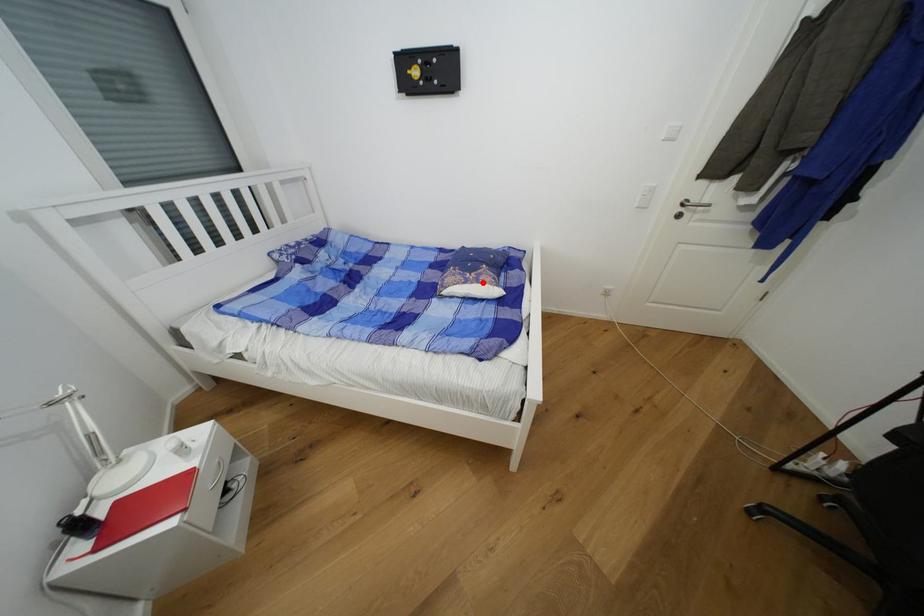
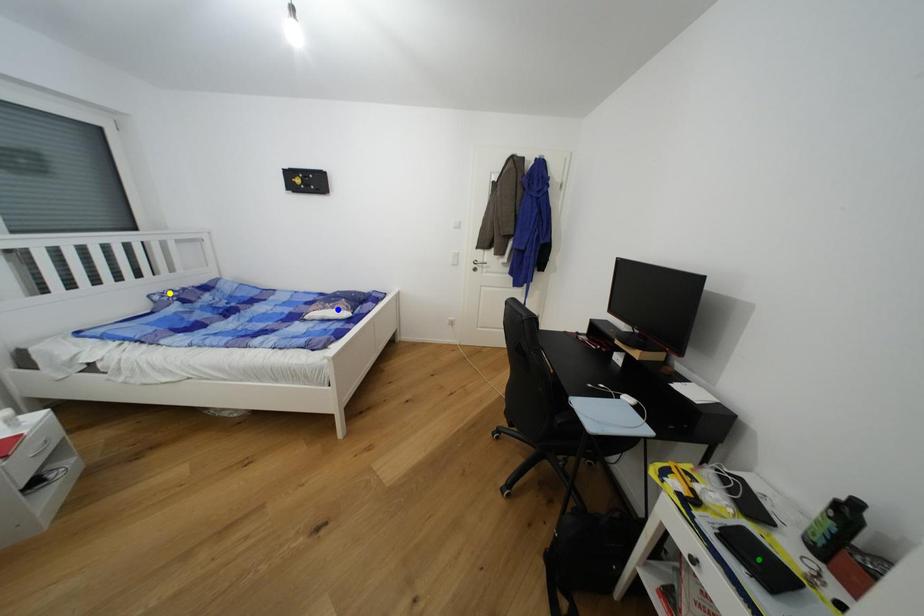
Question: I am providing you with two images of the same scene from different viewpoints. A red point is marked on the first image. You are given multiple points on the second image. Which point in image 2 is actually the same real-world point as the red point in image 1?

Choices:
 (A) yellow point
 (B) blue point
 (C) green point

Answer: (B)